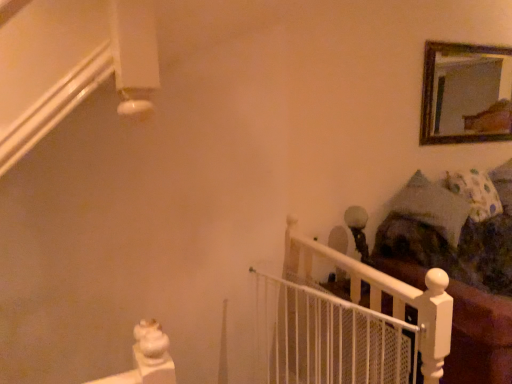
Question: Is fluffy white pillow at right smaller than white mesh gate at center?

Choices:
 (A) no
 (B) yes

Answer: (A)

Question: From a real-world perspective, is fluffy white pillow at right on top of white mesh gate at center?

Choices:
 (A) yes
 (B) no

Answer: (A)

Question: Considering the relative positions of fluffy white pillow at right and white mesh gate at center in the image provided, is fluffy white pillow at right to the right of white mesh gate at center from the viewer's perspective?

Choices:
 (A) yes
 (B) no

Answer: (A)

Question: Is fluffy white pillow at right bigger than white mesh gate at center?

Choices:
 (A) no
 (B) yes

Answer: (B)

Question: Is fluffy white pillow at right located outside white mesh gate at center?

Choices:
 (A) no
 (B) yes

Answer: (B)

Question: Is fluffy white pillow at right shorter than white mesh gate at center?

Choices:
 (A) no
 (B) yes

Answer: (B)

Question: Is the position of wooden-framed mirror at upper right less distant than that of fluffy white pillow at right?

Choices:
 (A) yes
 (B) no

Answer: (B)

Question: Is wooden-framed mirror at upper right to the left of fluffy white pillow at right from the viewer's perspective?

Choices:
 (A) yes
 (B) no

Answer: (A)

Question: From the image's perspective, is wooden-framed mirror at upper right beneath fluffy white pillow at right?

Choices:
 (A) yes
 (B) no

Answer: (B)

Question: Are wooden-framed mirror at upper right and fluffy white pillow at right far apart?

Choices:
 (A) no
 (B) yes

Answer: (B)

Question: From a real-world perspective, is wooden-framed mirror at upper right over fluffy white pillow at right?

Choices:
 (A) no
 (B) yes

Answer: (B)

Question: Are wooden-framed mirror at upper right and fluffy white pillow at right beside each other?

Choices:
 (A) yes
 (B) no

Answer: (B)

Question: Considering the relative sizes of dark brown fabric bed at right and fluffy white pillow at right in the image provided, is dark brown fabric bed at right wider than fluffy white pillow at right?

Choices:
 (A) no
 (B) yes

Answer: (B)